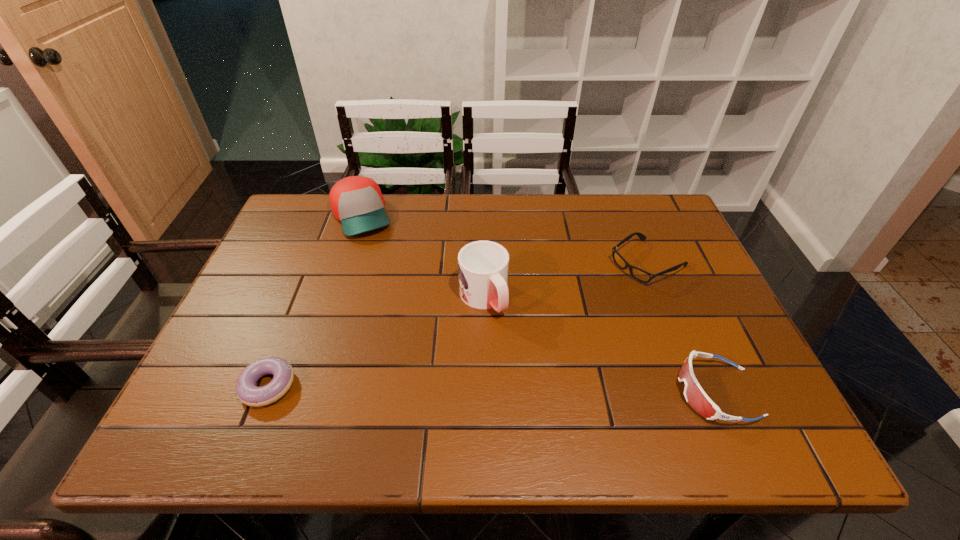
Identify the location of vacant point that satisfies the following two spatial constraints: 1. on the front side of the doughnut; 2. on the front-facing side of the third tallest object. (265, 392).